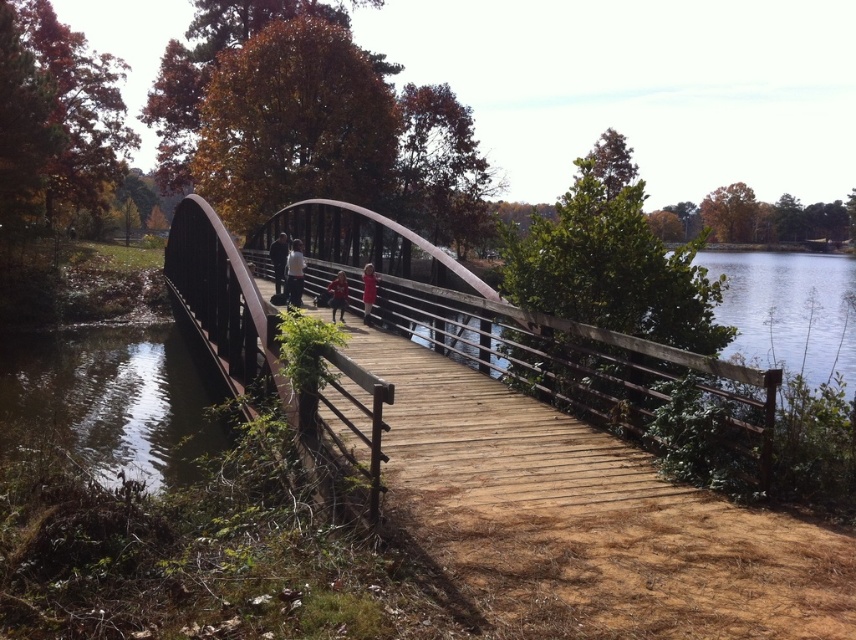
Who is positioned more to the right, wooden bridge at center or rusty metal bridge at center?

From the viewer's perspective, wooden bridge at center appears more on the right side.

Consider the image. Can you confirm if wooden bridge at center is shorter than rusty metal bridge at center?

Yes, wooden bridge at center is shorter than rusty metal bridge at center.

What do you see at coordinates (587, 518) in the screenshot?
I see `wooden bridge at center` at bounding box center [587, 518].

Where is `wooden bridge at center`? wooden bridge at center is located at coordinates (587, 518).